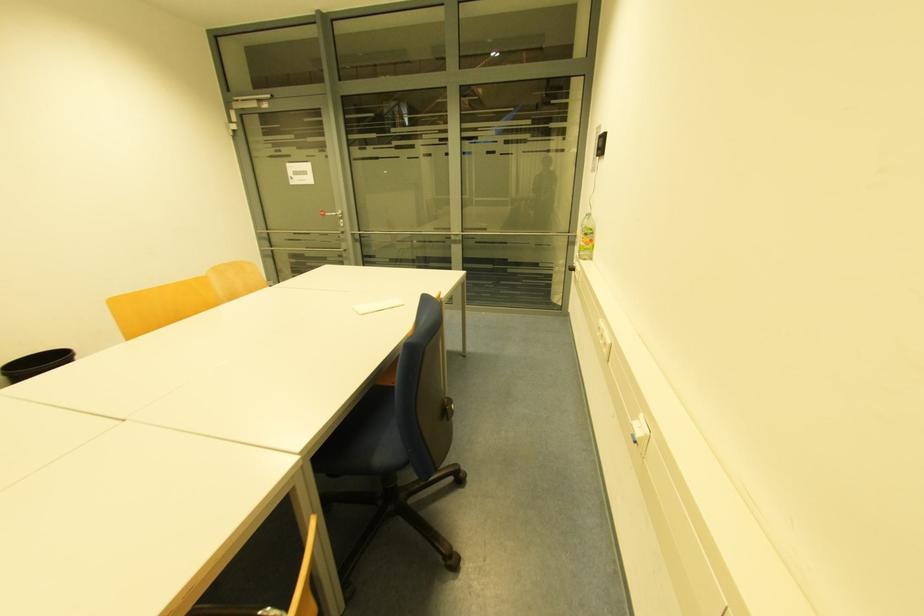
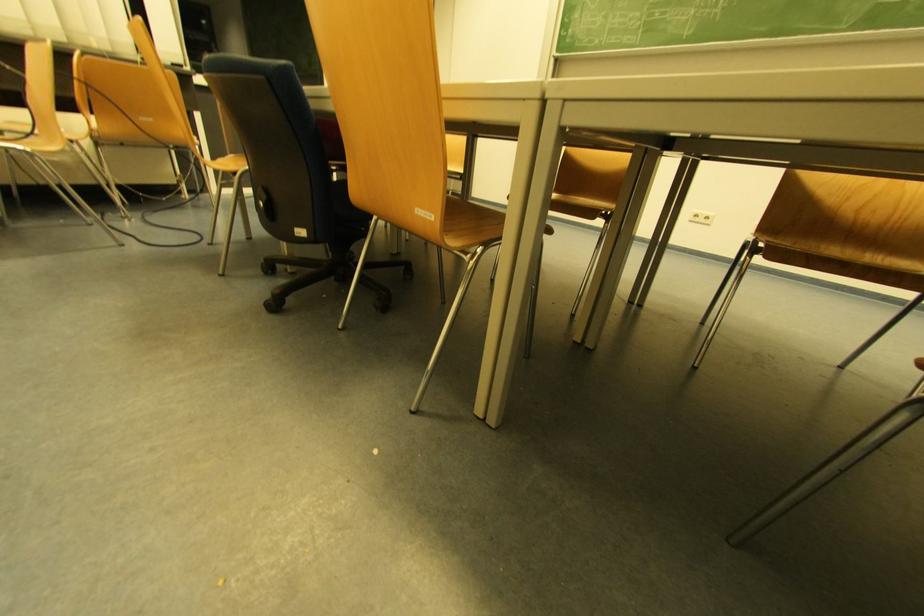
Based on the continuous images, in which direction is the camera rotating?

The camera's rotation is toward left-down.